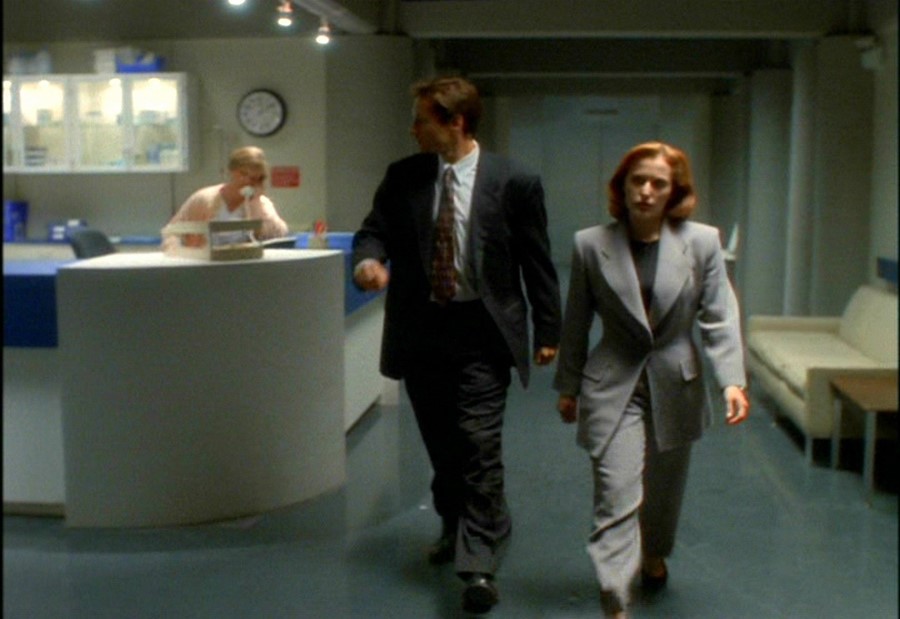
Locate an element on the screen. countertop is located at coordinates click(x=159, y=251).